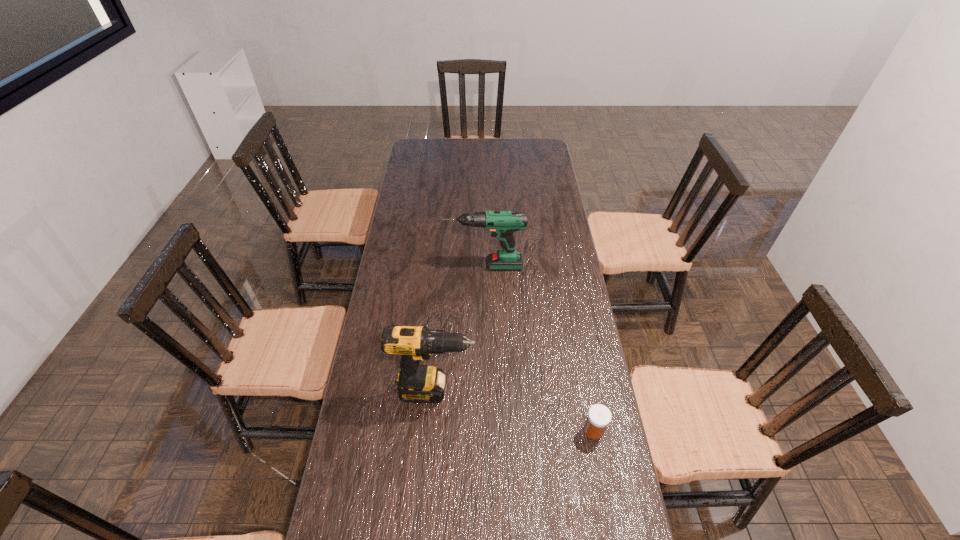
The image size is (960, 540). In order to click on object present at the right edge in this screenshot , I will do `click(599, 416)`.

Image resolution: width=960 pixels, height=540 pixels. I want to click on free location at the far edge, so click(x=460, y=138).

This screenshot has height=540, width=960. In the image, there is a desktop. In order to click on free region at the left edge in this screenshot , I will do `click(421, 207)`.

The height and width of the screenshot is (540, 960). Find the location of `free spot at the right edge of the desktop`. free spot at the right edge of the desktop is located at coordinates (583, 314).

This screenshot has width=960, height=540. I want to click on free space at the far left corner, so click(x=415, y=140).

Locate an element on the screen. The width and height of the screenshot is (960, 540). vacant point located between the second farthest object and the farther drill is located at coordinates (460, 328).

The width and height of the screenshot is (960, 540). Find the location of `vacant area that lies between the medicine and the farther drill`. vacant area that lies between the medicine and the farther drill is located at coordinates (539, 348).

The height and width of the screenshot is (540, 960). What are the coordinates of `vacant point located between the medicine and the farthest object` in the screenshot? It's located at (539, 348).

The height and width of the screenshot is (540, 960). What are the coordinates of `free space between the farther drill and the second nearest object` in the screenshot? It's located at (460, 328).

Where is `free spot between the second farthest object and the shortest object`? Image resolution: width=960 pixels, height=540 pixels. free spot between the second farthest object and the shortest object is located at coordinates (515, 410).